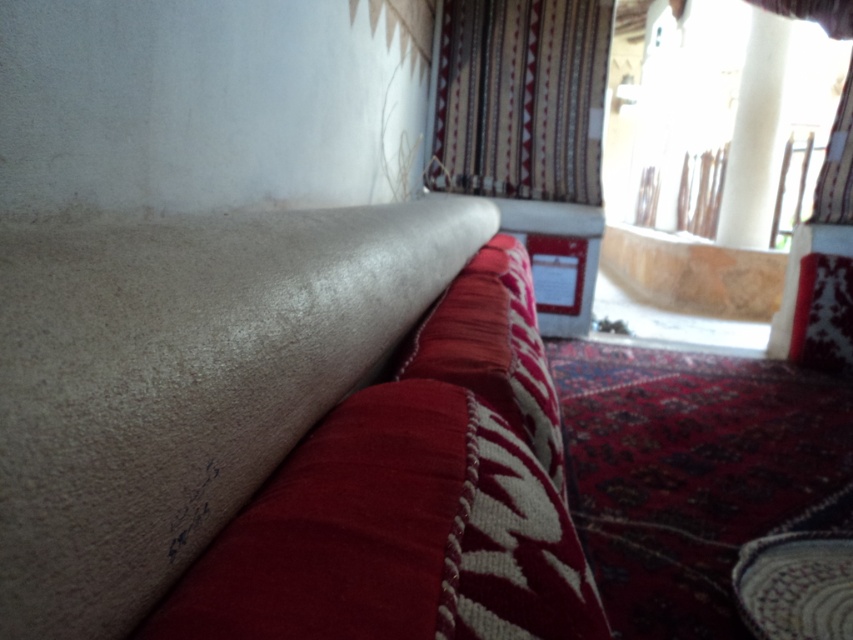
Question: Considering the real-world distances, which object is farthest from the patterned fabric curtain at upper center?

Choices:
 (A) suede-like beige couch at upper left
 (B) white smooth column at upper right

Answer: (A)

Question: Can you confirm if patterned fabric curtain at upper center is positioned to the right of white smooth column at upper right?

Choices:
 (A) no
 (B) yes

Answer: (A)

Question: Which of the following is the farthest from the observer?

Choices:
 (A) (494, 502)
 (B) (766, 225)

Answer: (B)

Question: Is patterned fabric curtain at upper center thinner than white smooth column at upper right?

Choices:
 (A) yes
 (B) no

Answer: (B)

Question: Does suede-like beige couch at upper left lie in front of white smooth column at upper right?

Choices:
 (A) yes
 (B) no

Answer: (A)

Question: Which point is closer to the camera?

Choices:
 (A) white smooth column at upper right
 (B) suede-like beige couch at upper left

Answer: (B)